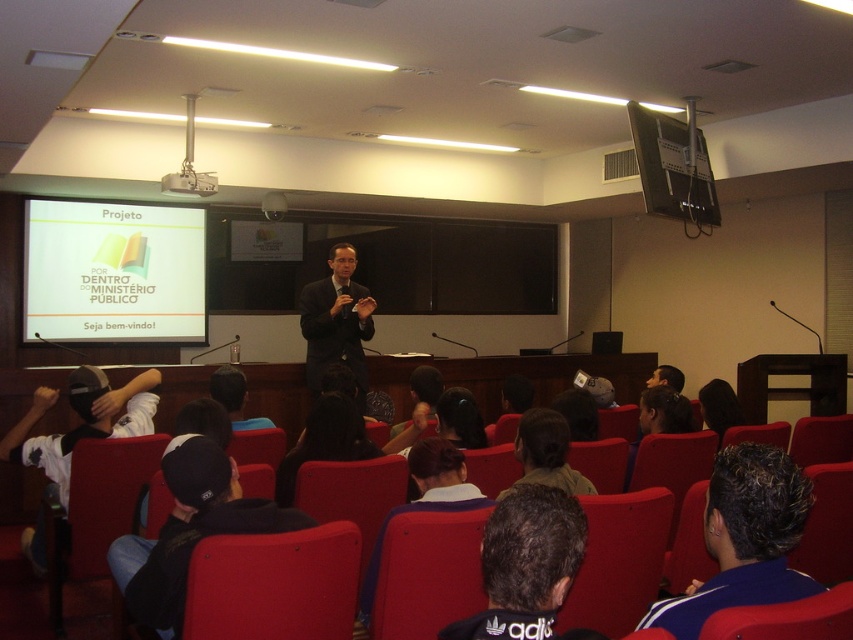
In the scene shown: Is blue fabric jacket at lower right to the right of black fabric cap at lower left from the viewer's perspective?

Indeed, blue fabric jacket at lower right is positioned on the right side of black fabric cap at lower left.

Can you confirm if blue fabric jacket at lower right is wider than black fabric cap at lower left?

Incorrect, blue fabric jacket at lower right's width does not surpass black fabric cap at lower left's.

The width and height of the screenshot is (853, 640). I want to click on blue fabric jacket at lower right, so click(744, 538).

Based on the photo, is matte red chair at lower center smaller than blue fabric jacket at lower right?

Indeed, matte red chair at lower center has a smaller size compared to blue fabric jacket at lower right.

Which is more to the left, matte red chair at lower center or blue fabric jacket at lower right?

Positioned to the left is matte red chair at lower center.

This screenshot has width=853, height=640. Find the location of `matte red chair at lower center`. matte red chair at lower center is located at coordinates (274, 584).

Based on the photo, who is more forward, (3,451) or (720,397)?

Point (3,451)

Identify the location of dark gray cap at lower left. The width and height of the screenshot is (853, 640). (80, 422).